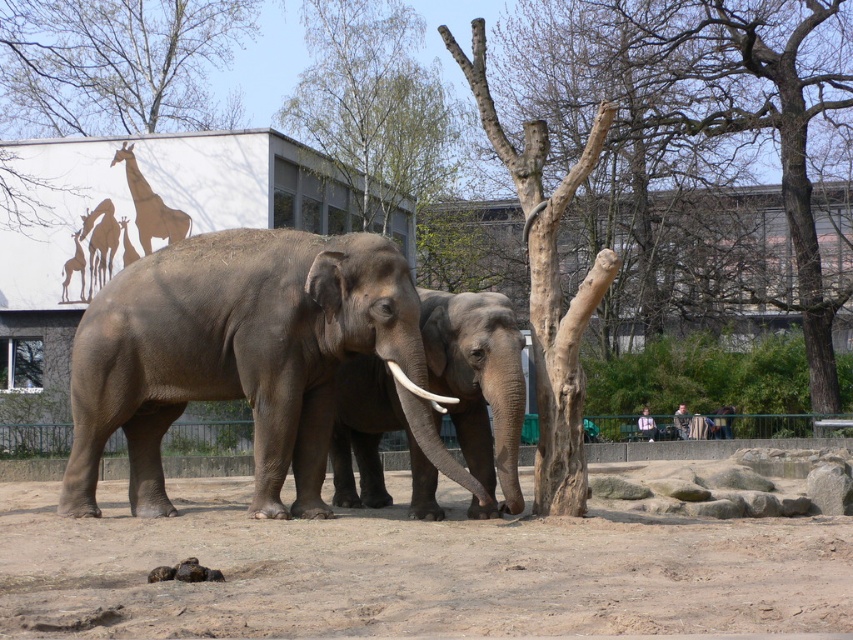
Is bare wood trunk at center thinner than gray matte elephant at center?

In fact, bare wood trunk at center might be wider than gray matte elephant at center.

Is bare wood trunk at center shorter than gray matte elephant at center?

In fact, bare wood trunk at center may be taller than gray matte elephant at center.

Who is more forward, (798, 285) or (355, 396)?

Point (355, 396) is more forward.

What are the coordinates of `bare wood trunk at center` in the screenshot? It's located at coord(755,113).

Who is higher up, bare wood trunk at center or light brown leather jacket at lower right?

bare wood trunk at center is above.

Where is `bare wood trunk at center`? The image size is (853, 640). bare wood trunk at center is located at coordinates [x=755, y=113].

Does brown sandy dirt at lower center have a greater height compared to bare wood tree at upper center?

No.

Does brown sandy dirt at lower center have a greater width compared to bare wood tree at upper center?

Yes.

Describe the element at coordinates (410, 570) in the screenshot. I see `brown sandy dirt at lower center` at that location.

Locate an element on the screen. brown sandy dirt at lower center is located at coordinates (410, 570).